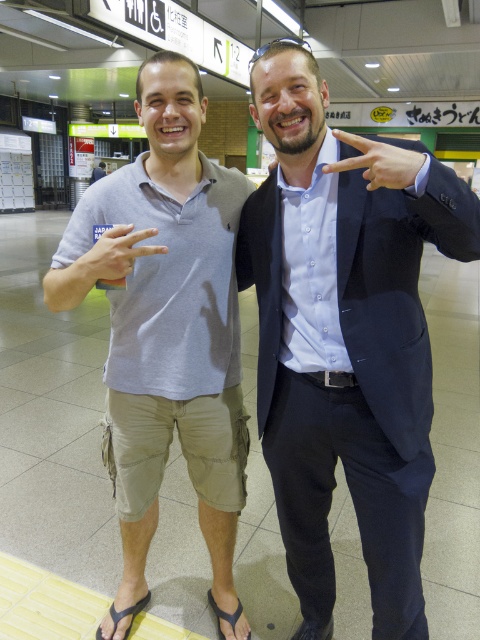
You are designing a photo frame for this image. The matte blue suit at center and the gray cotton polo shirt at left must both fit within the frame. Which object should you position closer to the bottom edge to ensure both are fully visible?

The matte blue suit at center is not as tall as the gray cotton polo shirt at left, so position the matte blue suit at center closer to the bottom edge to ensure both are fully visible.

You are a tailor who needs to determine which garment requires more fabric for alterations. Based on the image, which one between the matte blue suit at center and the gray cotton polo shirt at left needs more fabric?

The matte blue suit at center requires more fabric because it is larger in size than the gray cotton polo shirt at left.

You are a photographer holding a camera. You want to take a photo of the matte blue suit at center from a distance that ensures the entire suit fits in the frame. If your camera has a minimum focusing distance of 1 meter, will you need to adjust your position?

The matte blue suit at center and camera are 1.05 meters apart from each other. Since the camera has a minimum focusing distance of 1 meter, you can take the photo without needing to move further back because the distance is slightly more than the required minimum.